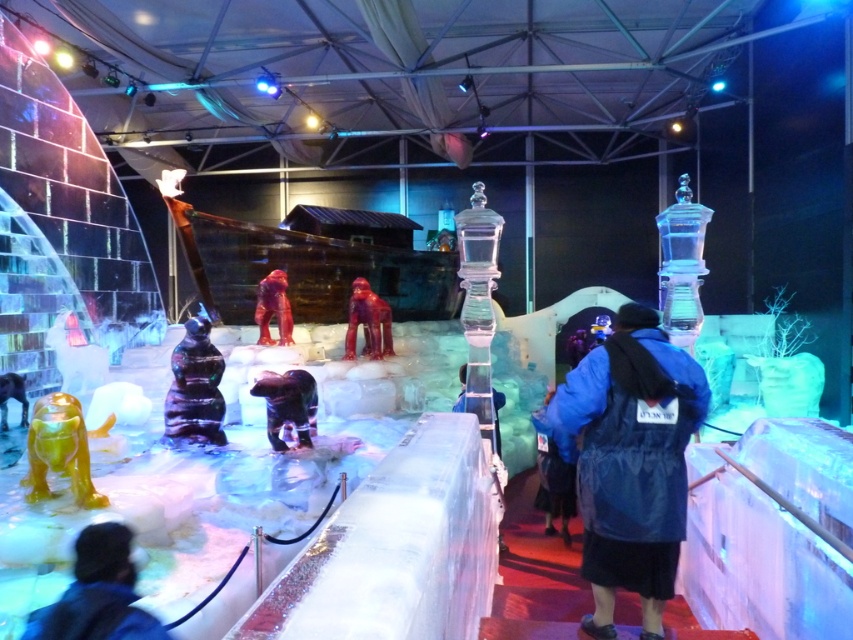
Question: Which object is the closest to the blue fabric backpack at center?

Choices:
 (A) blue fabric jacket at lower left
 (B) rubber-like red gorilla at center
 (C) shiny green ice sculpture at lower left

Answer: (B)

Question: Which of the following is the closest to the observer?

Choices:
 (A) rubber-like red gorilla at center
 (B) blue fabric backpack at center
 (C) shiny green ice sculpture at lower left

Answer: (C)

Question: From the image, what is the correct spatial relationship of blue fabric jacket at lower left in relation to rubber-like red gorilla at center?

Choices:
 (A) left
 (B) right

Answer: (B)

Question: Which object appears farthest from the camera in this image?

Choices:
 (A) blue fabric jacket at center
 (B) glossy purple statue at center
 (C) rubber-like red gorilla at center

Answer: (C)

Question: Is shiny green ice sculpture at lower left to the right of glossy red statue at center from the viewer's perspective?

Choices:
 (A) no
 (B) yes

Answer: (A)

Question: Is glossy red statue at center wider than rubber-like red gorilla at center?

Choices:
 (A) yes
 (B) no

Answer: (A)